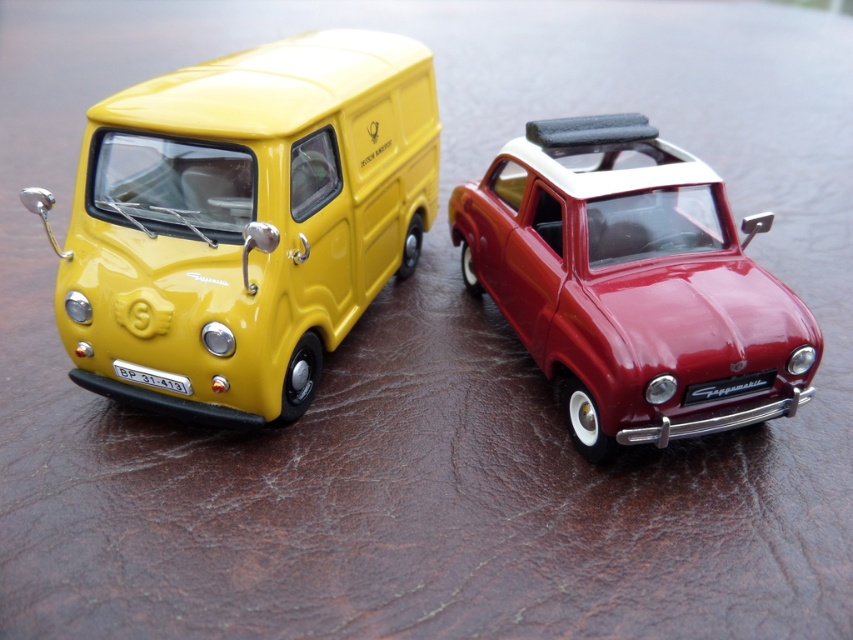
Question: Which object is closer to the camera taking this photo?

Choices:
 (A) shiny red car at center
 (B) yellow glossy van at left

Answer: (B)

Question: In this image, where is yellow glossy van at left located relative to shiny red car at center?

Choices:
 (A) left
 (B) right

Answer: (A)

Question: From the image, what is the correct spatial relationship of yellow glossy van at left in relation to shiny red car at center?

Choices:
 (A) left
 (B) right

Answer: (A)

Question: Is yellow glossy van at left positioned before shiny red car at center?

Choices:
 (A) no
 (B) yes

Answer: (B)